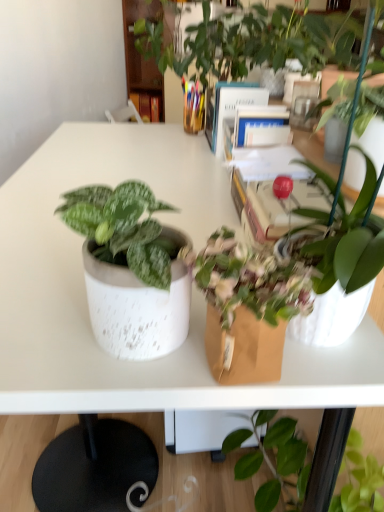
What is the approximate height of blue hardcover book at upper center, which appears as the second book when viewed from the back?

10.89 inches.

Locate an element on the screen. hardcover book at center, which is counted as the 3th book, starting from the front is located at coordinates (147, 106).

Consider the image. How distant is hardcover book at center, marked as the first book in a top-to-bottom arrangement, from blue hardcover book at upper center, marked as the 2th book in a left-to-right arrangement?

A distance of 1.91 meters exists between hardcover book at center, marked as the first book in a top-to-bottom arrangement, and blue hardcover book at upper center, marked as the 2th book in a left-to-right arrangement.

Who is smaller, hardcover book at center, acting as the 3th book starting from the bottom, or blue hardcover book at upper center, marked as the 2th book in a left-to-right arrangement?

hardcover book at center, acting as the 3th book starting from the bottom.

Between point (154, 97) and point (218, 95), which one is positioned in front?

Point (218, 95)

From the picture: Which is more to the left, hardcover book at center, the third book viewed from the right, or blue hardcover book at upper center, placed as the second book when sorted from bottom to top?

From the viewer's perspective, hardcover book at center, the third book viewed from the right, appears more on the left side.

Based on their sizes in the image, would you say blue hardcover book at upper center, the second book when ordered from front to back, is bigger or smaller than hardcover book at center, the 3th book positioned from the left?

In the image, blue hardcover book at upper center, the second book when ordered from front to back, appears to be larger than hardcover book at center, the 3th book positioned from the left.

Is blue hardcover book at upper center, the 2th book from the top, far from hardcover book at center, marked as the 3th book in a top-to-bottom arrangement?

blue hardcover book at upper center, the 2th book from the top, is near hardcover book at center, marked as the 3th book in a top-to-bottom arrangement, not far away.

Is blue hardcover book at upper center, placed as the second book when sorted from bottom to top, facing towards hardcover book at center, the first book when ordered from bottom to top?

No.

Starting from the hardcover book at center, the 3th book positioned from the left, which book is the 1st one to the left? Please provide its 2D coordinates.

[(228, 106)]

Looking at their sizes, would you say hardcover book at center, which appears as the 1th book when viewed from the right, is wider or thinner than hardcover book at center, the first book viewed from the back?

Clearly, hardcover book at center, which appears as the 1th book when viewed from the right, has more width compared to hardcover book at center, the first book viewed from the back.

Consider the image. Is the position of hardcover book at center, the first book when ordered from bottom to top, more distant than that of hardcover book at center, which is counted as the 3th book, starting from the front?

No, it is in front of hardcover book at center, which is counted as the 3th book, starting from the front.

Locate an element on the screen. This screenshot has width=384, height=512. the 2nd book above the hardcover book at center, the first book positioned from the front (from the image's perspective) is located at coordinates (147, 106).

Is point (213, 132) closer or farther from the camera than point (154, 108)?

Point (213, 132) is positioned closer to the camera compared to point (154, 108).

In the scene shown: From a real-world perspective, which object stands above the other?

In real-world perspective, blue hardcover book at upper center, placed as the second book when sorted from bottom to top, is above.

Considering the sizes of blue hardcover book at upper center, marked as the 2th book in a left-to-right arrangement, and hardcover book at center, the third book viewed from the right, in the image, is blue hardcover book at upper center, marked as the 2th book in a left-to-right arrangement, wider or thinner than hardcover book at center, the third book viewed from the right,?

In the image, blue hardcover book at upper center, marked as the 2th book in a left-to-right arrangement, appears to be wider than hardcover book at center, the third book viewed from the right.

Can you tell me how much blue hardcover book at upper center, marked as the 2th book in a left-to-right arrangement, and hardcover book at center, which is counted as the 3th book, starting from the front, differ in facing direction?

The angle between the facing direction of blue hardcover book at upper center, marked as the 2th book in a left-to-right arrangement, and the facing direction of hardcover book at center, which is counted as the 3th book, starting from the front, is 70.6 degrees.

Is hardcover book at center, the third book positioned from the back, looking in the opposite direction of blue hardcover book at upper center, placed as the second book when sorted from bottom to top?

No, hardcover book at center, the third book positioned from the back, is not facing away from blue hardcover book at upper center, placed as the second book when sorted from bottom to top.

Is hardcover book at center, the first book when ordered from bottom to top, wider than blue hardcover book at upper center, marked as the 2th book in a left-to-right arrangement?

No.

Between hardcover book at center, the third book positioned from the back, and blue hardcover book at upper center, placed as the second book when sorted from bottom to top, which one is positioned in front?

hardcover book at center, the third book positioned from the back, is more forward.

Between hardcover book at center, the third book positioned from the back, and blue hardcover book at upper center, the second book when ordered from front to back, which one has larger size?

blue hardcover book at upper center, the second book when ordered from front to back, is bigger.

Based on the photo, considering the relative sizes of hardcover book at center, the third book viewed from the right, and hardcover book at center, the third book positioned from the back, in the image provided, is hardcover book at center, the third book viewed from the right, bigger than hardcover book at center, the third book positioned from the back,?

Incorrect, hardcover book at center, the third book viewed from the right, is not larger than hardcover book at center, the third book positioned from the back.

At what (x,y) coordinates should I click in order to perform the action: click on the 1st book positioned above the hardcover book at center, the first book viewed from the back (from a real-world perspective). Please return your answer as a coordinate pair (x, y). The height and width of the screenshot is (512, 384). Looking at the image, I should click on (256, 129).

Is point (160, 104) behind point (253, 136)?

Yes.

This screenshot has height=512, width=384. In order to click on book above the blue hardcover book at upper center, arranged as the second book when viewed from the right (from the image's perspective) in this screenshot , I will do `click(147, 106)`.

Locate an element on the screen. book that is the 1st one when counting backward from the hardcover book at center, which appears as the 1th book when viewed from the right is located at coordinates (228, 106).

Based on their spatial positions, is hardcover book at center, the third book viewed from the right, or blue hardcover book at upper center, placed as the second book when sorted from bottom to top, further from hardcover book at center, marked as the 3th book in a top-to-bottom arrangement?

hardcover book at center, the third book viewed from the right, is further to hardcover book at center, marked as the 3th book in a top-to-bottom arrangement.

Considering their positions, is hardcover book at center, the 3th book positioned from the left, positioned closer to blue hardcover book at upper center, arranged as the second book when viewed from the right, than hardcover book at center, marked as the first book in a top-to-bottom arrangement?

hardcover book at center, the 3th book positioned from the left, is positioned closer to the anchor blue hardcover book at upper center, arranged as the second book when viewed from the right.

From the image, which object appears to be farther from hardcover book at center, marked as the first book in a top-to-bottom arrangement, hardcover book at center, the first book positioned from the front, or blue hardcover book at upper center, the second book when ordered from front to back?

hardcover book at center, the first book positioned from the front, lies further to hardcover book at center, marked as the first book in a top-to-bottom arrangement, than the other object.

Looking at the image, which one is located closer to hardcover book at center, which is counted as the 3th book, starting from the front, blue hardcover book at upper center, the 2th book from the top, or hardcover book at center, the first book positioned from the front?

blue hardcover book at upper center, the 2th book from the top.

Looking at this image, based on their spatial positions, is hardcover book at center, marked as the first book in a top-to-bottom arrangement, or hardcover book at center, marked as the 3th book in a top-to-bottom arrangement, closer to blue hardcover book at upper center, placed as the second book when sorted from bottom to top?

hardcover book at center, marked as the 3th book in a top-to-bottom arrangement, lies closer to blue hardcover book at upper center, placed as the second book when sorted from bottom to top, than the other object.

Based on their spatial positions, is blue hardcover book at upper center, the 2th book from the top, or hardcover book at center, which is counted as the 3th book, starting from the front, further from hardcover book at center, marked as the 3th book in a top-to-bottom arrangement?

hardcover book at center, which is counted as the 3th book, starting from the front.

Locate an element on the screen. This screenshot has height=512, width=384. book located between hardcover book at center, the 3th book positioned from the left, and hardcover book at center, which is counted as the 3th book, starting from the front, in the depth direction is located at coordinates (228, 106).